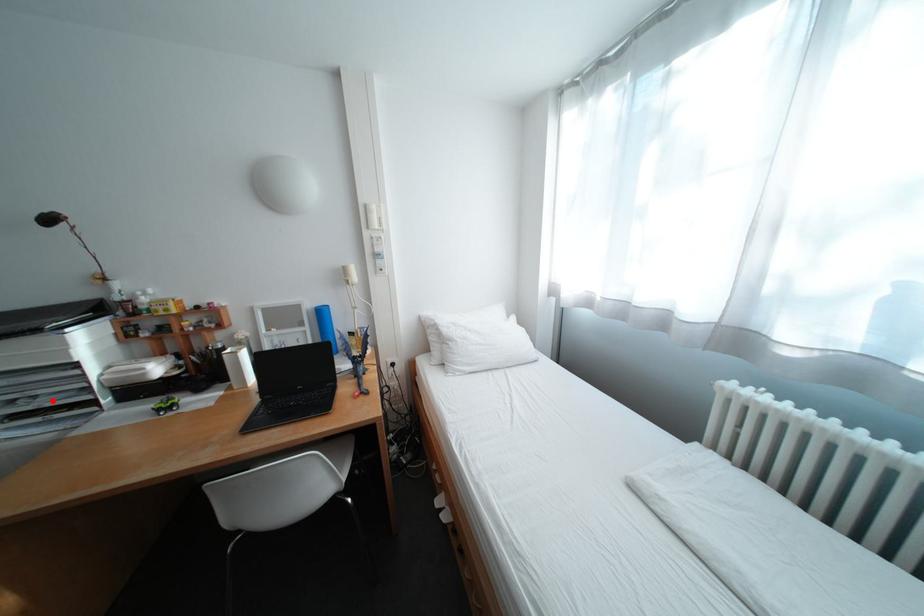
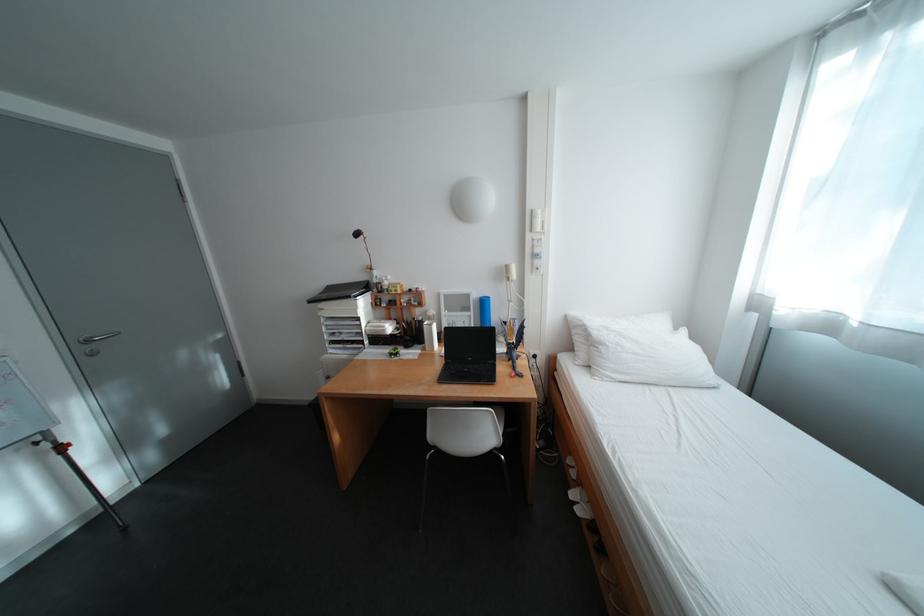
Question: I am providing you with two images of the same scene from different viewpoints. Image1 has a red point marked. In image2, the corresponding 3D location appears at what relative position? Reply with the corresponding letter.

Choices:
 (A) Closer
 (B) Farther

Answer: (A)